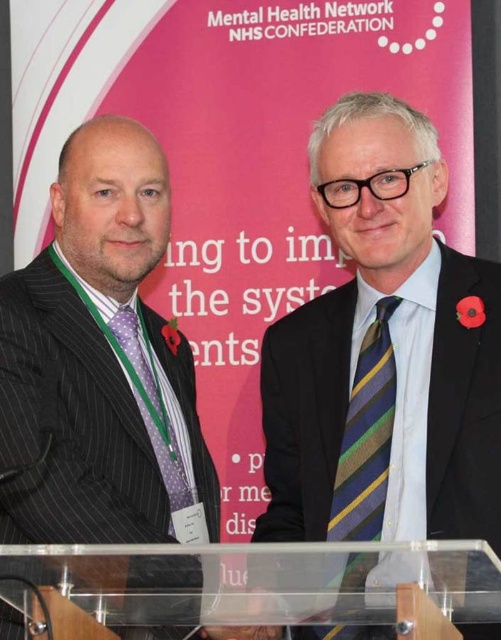
You are organizing a charity event and need to ensure that all participants wear attire that adheres to specific size requirements. The rule states that the width of the suit must be at least twice the width of the tie. Given the black pinstripe suit at left and the striped wool tie at center, can the participant wearing this outfit comply with the rule?

The black pinstripe suit at left is wider than the striped wool tie at center, but the description only states that the suit is larger in width, not by how much. Since the requirement specifies the suit must be at least twice as wide as the tie, we cannot confirm compliance without exact measurements.

You are organizing a formal event and need to ensure that all speakers have ties that meet specific size requirements. You notice two men at the podium wearing striped wool tie at center and striped silk tie at center. Which tie meets the requirement of being larger?

The striped wool tie at center is larger than the striped silk tie at center, so it meets the requirement of being larger.